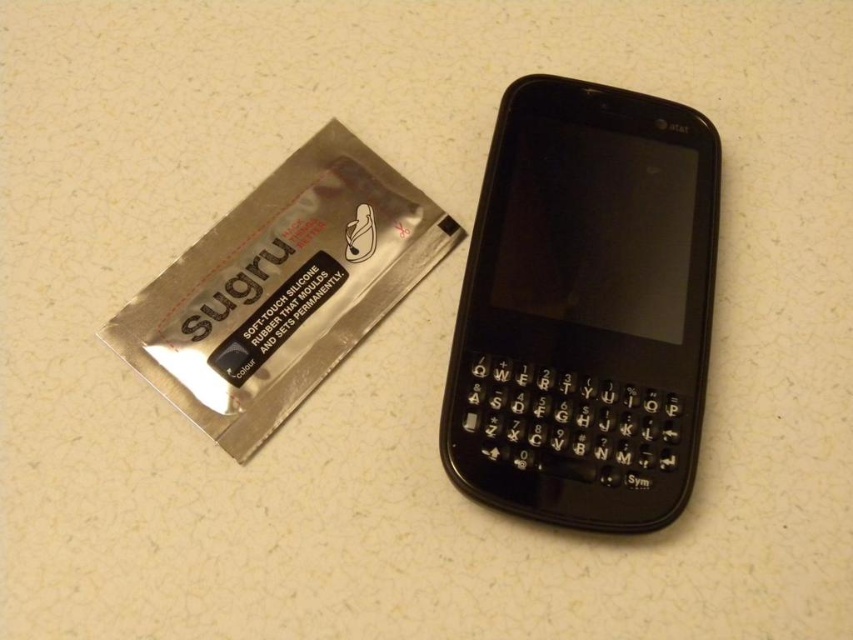
Looking at this image, you are trying to locate the black plastic smartphone at center in the image. According to the coordinates provided, where would you find it?

The black plastic smartphone at center is located at point coordinates of [585,308].